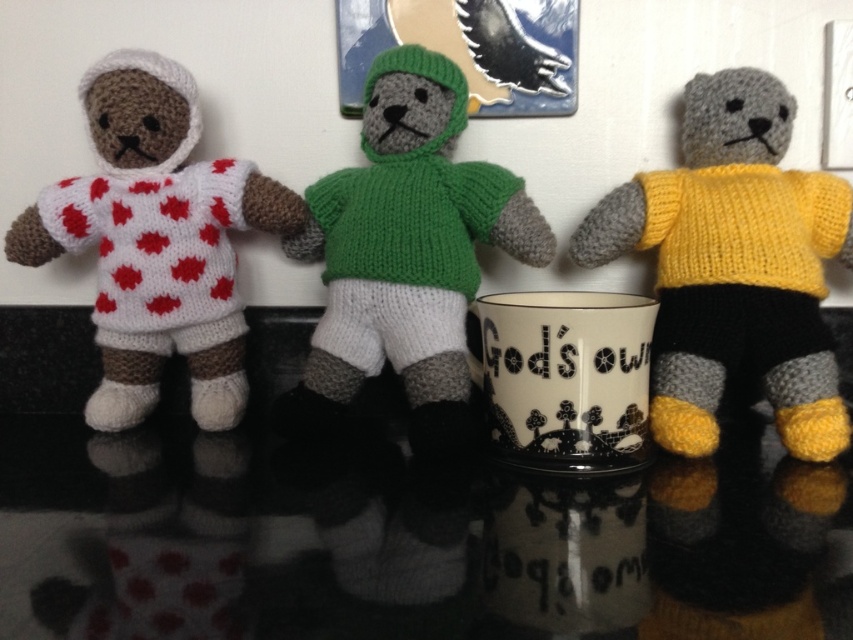
You are a delivery person who needs to place a small package between the yellow knitted sweater at center and the white knitted doll at left. The package is 18 inches long. Will it fit between them?

The yellow knitted sweater at center is 17.75 inches from the white knitted doll at left. Since the package is 18 inches long, it will not fit between them as the distance is slightly shorter than the package length.

You are standing in front of the three teddy bears on the reflective black surface. You notice two points marked on the image at coordinates point (445, 301) and point (212, 412). Which of these points is nearer to you?

Point (445, 301) is closer to the viewer than point (212, 412), so the point at (445, 301) is nearer to you.

You are a customer in a gift shop and want to buy the yellow knitted sweater at center and the white knitted doll at left. The store has a rule that if an item is closer to you, you must purchase it first. Which item should you buy first?

The yellow knitted sweater at center is closer to the viewer than the white knitted doll at left, so you must purchase the yellow knitted sweater at center first according to the store rule.